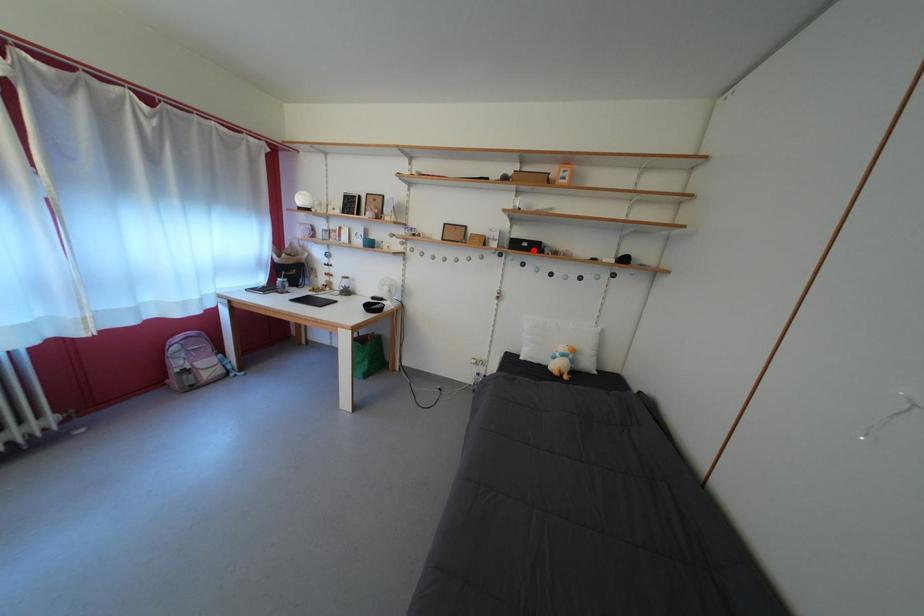
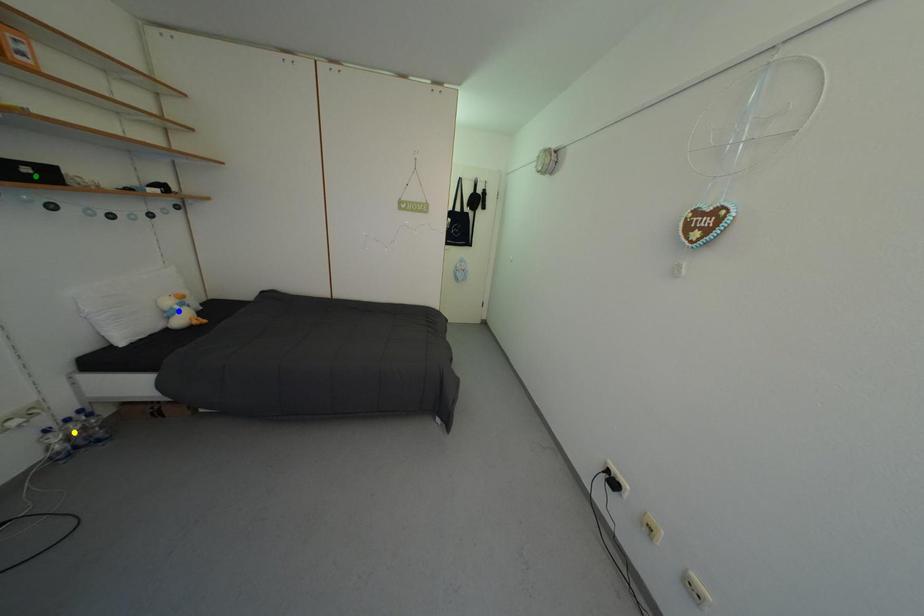
Question: I am providing you with two images of the same scene from different viewpoints. A red point is marked on the first image. You are given multiple points on the second image. Can you choose the point in image 2 that corresponds to the point in image 1?

Choices:
 (A) yellow point
 (B) blue point
 (C) green point

Answer: (C)